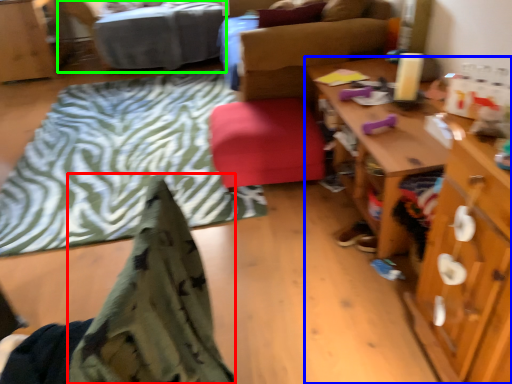
Question: Considering the real-world distances, which object is farthest from blanket (highlighted by a red box)? desk (highlighted by a blue box) or bed (highlighted by a green box)?

Choices:
 (A) desk
 (B) bed

Answer: (B)